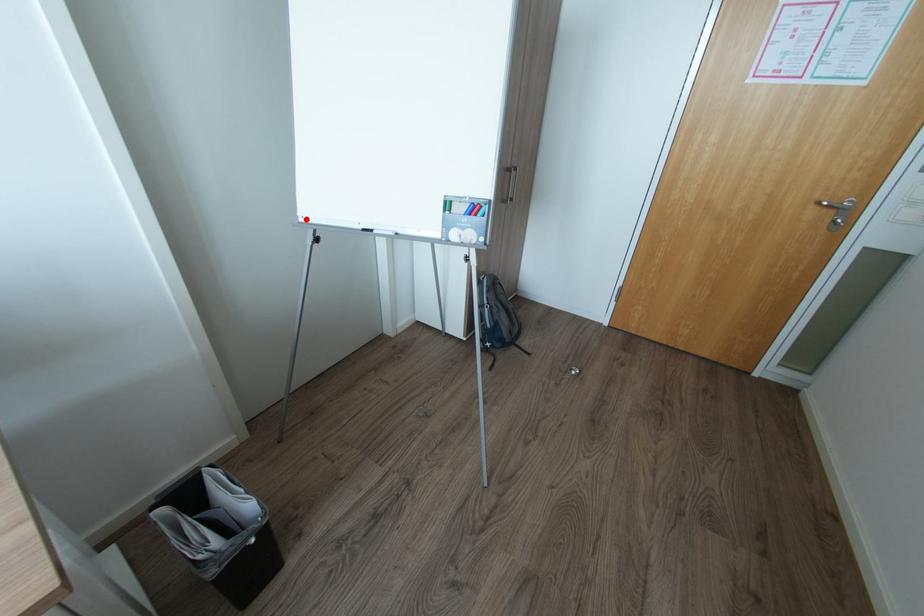
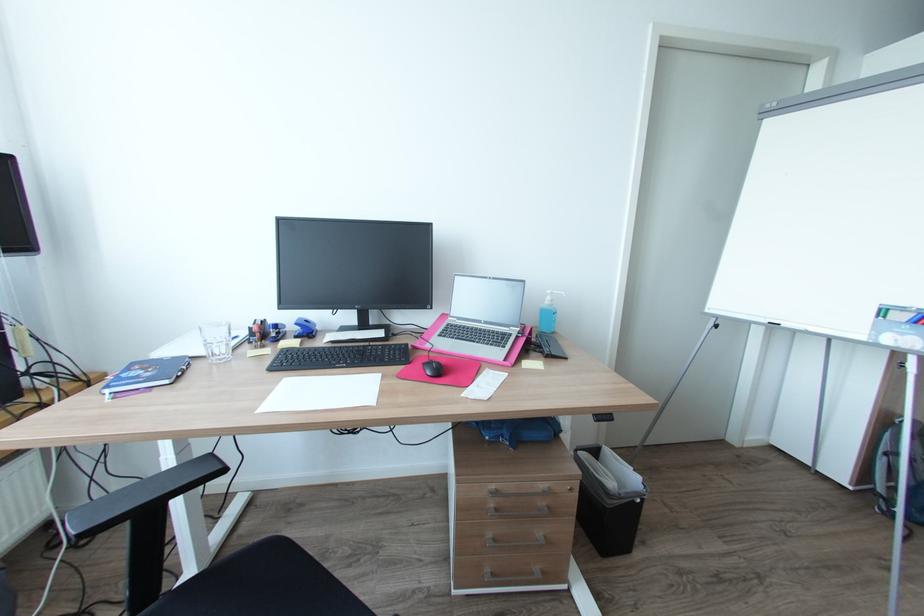
The point at the highlighted location is marked in the first image. Where is the corresponding point in the second image?

(712, 310)